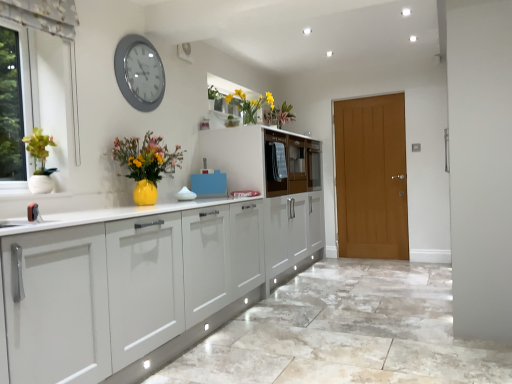
Question: Is matte yellow vase at center wider or thinner than yellow matte vase at upper center?

Choices:
 (A) wide
 (B) thin

Answer: (B)

Question: Is matte yellow vase at center in front of or behind yellow matte vase at upper center in the image?

Choices:
 (A) front
 (B) behind

Answer: (A)

Question: Considering the real-world distances, which object is closest to the matte wood door at right?

Choices:
 (A) yellow matte vase at upper center
 (B) matte white drawer at center
 (C) blue plastic cutting board at center
 (D) wooden cabinet at center
 (E) silver metallic clock at upper left

Answer: (B)

Question: Which of these objects is positioned farthest from the matte white drawer at center?

Choices:
 (A) silver metallic clock at upper left
 (B) matte wood door at right
 (C) yellow matte vase at upper center
 (D) wooden cabinet at center
 (E) matte yellow vase at center

Answer: (E)